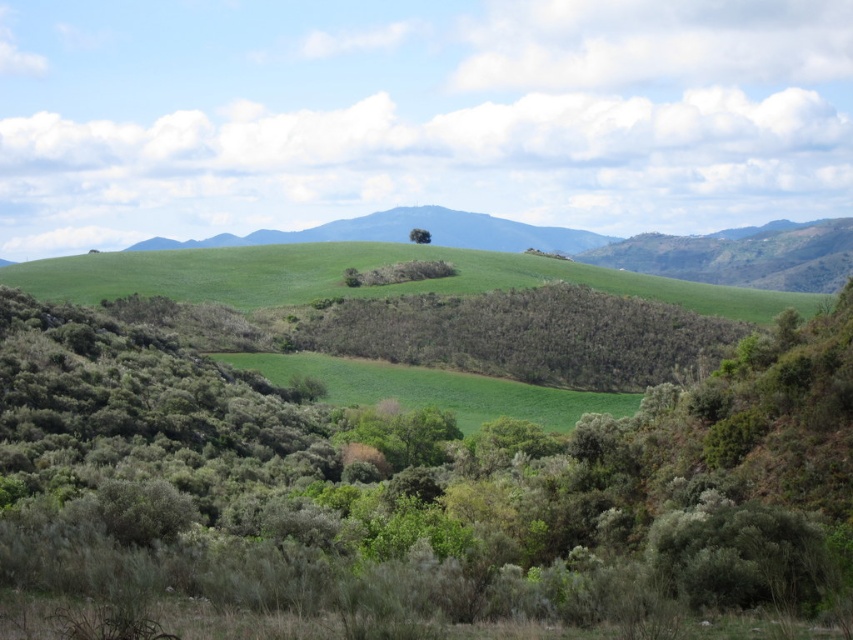
Does green grassy hill at center appear over green leafy tree at center?

Yes.

Can you confirm if green grassy hill at center is bigger than green leafy tree at center?

Indeed, green grassy hill at center has a larger size compared to green leafy tree at center.

Does point (260, 230) come in front of point (427, 232)?

That is False.

At what (x,y) coordinates should I click in order to perform the action: click on green grassy hill at center. Please return your answer as a coordinate pair (x, y). Looking at the image, I should click on (408, 230).

Measure the distance between point (502, 413) and camera.

1049.07 feet

In the scene shown: Who is higher up, green grassy field at center or green grassy hill at center?

green grassy hill at center is above.

Is point (418, 374) less distant than point (364, 230)?

Yes.

What are the coordinates of `green grassy field at center` in the screenshot? It's located at (434, 388).

Which is behind, point (502, 385) or point (415, 228)?

The point (415, 228) is behind.

Can you confirm if green grassy field at center is positioned to the left of green leafy tree at center?

No, green grassy field at center is not to the left of green leafy tree at center.

Locate an element on the screen. The image size is (853, 640). green grassy field at center is located at coordinates (434, 388).

What are the coordinates of `green grassy field at center` in the screenshot? It's located at (434, 388).